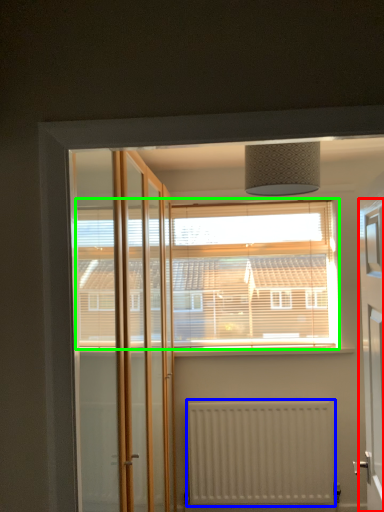
Question: Based on their relative distances, which object is farther from elevator (highlighted by a red box)? Choose from radiator (highlighted by a blue box) and window (highlighted by a green box).

Choices:
 (A) radiator
 (B) window

Answer: (A)